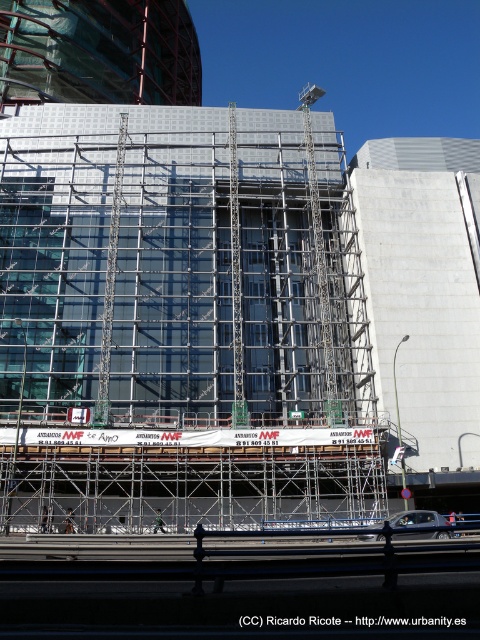
You are a construction worker who just arrived at the site. You see the metal scaffolding at center and the metallic helmet at center. Which object is closer to you?

The metal scaffolding at center is closer to you because it is in front of the metallic helmet at center.

You are a construction worker who needs to place a metallic helmet at center so it doesn not block the banner. Given the banner is on the metal scaffolding at center, can you fit the helmet next to it without overlapping?

The metal scaffolding at center is wider than the metallic helmet at center, so yes, you can place the metallic helmet at center next to the banner on the metal scaffolding at center without overlapping since there is enough space.

You are a construction worker standing at the base of the building. You need to place a new safety sign that must be visible from the ground. Given the metal scaffolding at center and the metallic helmet at center, which object should the sign be attached to for maximum visibility?

The metal scaffolding at center is much taller than the metallic helmet at center, so attaching the safety sign to the metal scaffolding at center would ensure it is visible from the ground.